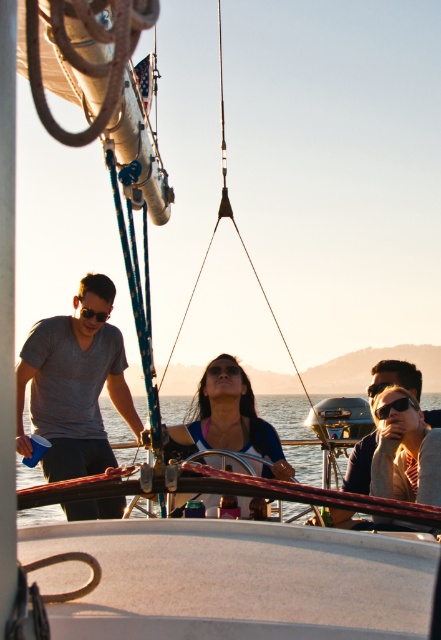
Can you confirm if black plastic goggles at center is shorter than matte black sunglasses at left?

No.

Is black plastic goggles at center positioned at the back of matte black sunglasses at left?

No.

Who is more forward, (224, 372) or (103, 316)?

Point (224, 372)

Where is `black plastic goggles at center`? The width and height of the screenshot is (441, 640). black plastic goggles at center is located at coordinates (223, 369).

Does matte blue shirt at center have a smaller size compared to black plastic goggles at center?

No.

Can you confirm if matte blue shirt at center is thinner than black plastic goggles at center?

No.

The height and width of the screenshot is (640, 441). Describe the element at coordinates (227, 426) in the screenshot. I see `matte blue shirt at center` at that location.

Where is `matte blue shirt at center`? matte blue shirt at center is located at coordinates (227, 426).

Who is shorter, gray matte shirt at left or matte black sunglasses at left?

matte black sunglasses at left

Is gray matte shirt at left closer to camera compared to matte black sunglasses at left?

That is True.

This screenshot has height=640, width=441. What are the coordinates of `gray matte shirt at left` in the screenshot? It's located at (73, 394).